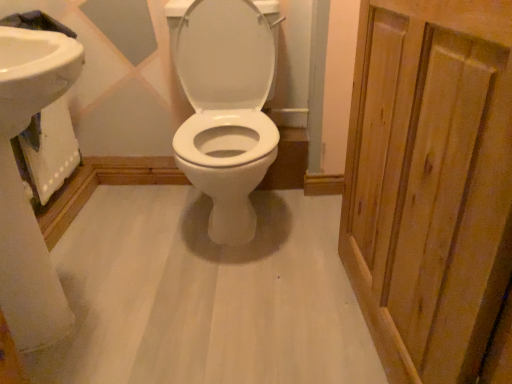
Where is `white glossy toilet at center`? Image resolution: width=512 pixels, height=384 pixels. white glossy toilet at center is located at coordinates (226, 110).

What do you see at coordinates (22, 185) in the screenshot?
I see `white glossy sink at left` at bounding box center [22, 185].

Image resolution: width=512 pixels, height=384 pixels. What do you see at coordinates (430, 182) in the screenshot?
I see `natural wood screen door at right` at bounding box center [430, 182].

What are the coordinates of `white glossy toilet at center` in the screenshot? It's located at (226, 110).

Is natural wood screen door at right facing away from white glossy toilet at center?

No, natural wood screen door at right is not facing away from white glossy toilet at center.

Who is shorter, natural wood screen door at right or white glossy toilet at center?

natural wood screen door at right is shorter.

Is point (473, 357) closer to viewer compared to point (210, 87)?

Yes, it is.

Who is bigger, natural wood screen door at right or white glossy toilet at center?

Bigger between the two is white glossy toilet at center.

Considering the points (219, 241) and (13, 102), which point is behind, point (219, 241) or point (13, 102)?

The point (219, 241) is farther.

Where is `toilet on the right of white glossy sink at left`? This screenshot has height=384, width=512. toilet on the right of white glossy sink at left is located at coordinates point(226,110).

In the image, is white glossy toilet at center positioned in front of or behind white glossy sink at left?

In the image, white glossy toilet at center appears behind white glossy sink at left.

From a real-world perspective, does white glossy toilet at center stand above white glossy sink at left?

No, from a real-world perspective, white glossy toilet at center is not above white glossy sink at left.

How many degrees apart are the facing directions of natural wood screen door at right and white glossy sink at left?

The angular difference between natural wood screen door at right and white glossy sink at left is 175 degrees.

From a real-world perspective, is natural wood screen door at right on white glossy sink at left?

Indeed, from a real-world perspective, natural wood screen door at right stands above white glossy sink at left.

Can you confirm if natural wood screen door at right is shorter than white glossy sink at left?

In fact, natural wood screen door at right may be taller than white glossy sink at left.

Where is `screen door in front of the white glossy sink at left`? The image size is (512, 384). screen door in front of the white glossy sink at left is located at coordinates (430, 182).

Which object is positioned more to the right, white glossy sink at left or white glossy toilet at center?

white glossy toilet at center is more to the right.

In terms of size, does white glossy sink at left appear bigger or smaller than white glossy toilet at center?

Clearly, white glossy sink at left is smaller in size than white glossy toilet at center.

Is point (33, 228) in front of point (245, 15)?

Yes.

Between white glossy sink at left and white glossy toilet at center, which one is positioned behind?

Positioned behind is white glossy toilet at center.

Is white glossy sink at left directly adjacent to natural wood screen door at right?

white glossy sink at left and natural wood screen door at right are clearly separated.

I want to click on screen door that appears in front of the white glossy sink at left, so click(x=430, y=182).

From a real-world perspective, which is physically above, white glossy sink at left or natural wood screen door at right?

In real-world perspective, natural wood screen door at right is above.

Considering the sizes of objects white glossy sink at left and natural wood screen door at right in the image provided, who is bigger, white glossy sink at left or natural wood screen door at right?

Bigger between the two is white glossy sink at left.

How many degrees apart are the facing directions of white glossy toilet at center and natural wood screen door at right?

84.8 degrees.

Is white glossy toilet at center facing towards natural wood screen door at right?

No.

Who is more distant, white glossy toilet at center or natural wood screen door at right?

white glossy toilet at center is further from the camera.

From the picture: Is white glossy toilet at center not within natural wood screen door at right?

white glossy toilet at center lies outside natural wood screen door at right's area.

Find the location of a particular element. The width and height of the screenshot is (512, 384). screen door that is on the right side of white glossy toilet at center is located at coordinates (430, 182).

I want to click on sink above the white glossy toilet at center (from a real-world perspective), so click(x=22, y=185).

When comparing their distances from white glossy toilet at center, does natural wood screen door at right or white glossy sink at left seem further?

Among the two, white glossy sink at left is located further to white glossy toilet at center.

Looking at the image, which one is located further to natural wood screen door at right, white glossy toilet at center or white glossy sink at left?

Among the two, white glossy sink at left is located further to natural wood screen door at right.

Based on their spatial positions, is white glossy sink at left or natural wood screen door at right further from white glossy toilet at center?

The object further to white glossy toilet at center is white glossy sink at left.

Considering their positions, is natural wood screen door at right positioned closer to white glossy sink at left than white glossy toilet at center?

white glossy toilet at center is positioned closer to the anchor white glossy sink at left.

From the image, which object appears to be nearer to white glossy sink at left, white glossy toilet at center or natural wood screen door at right?

Based on the image, white glossy toilet at center appears to be nearer to white glossy sink at left.

Considering their positions, is white glossy sink at left positioned further to natural wood screen door at right than white glossy toilet at center?

Among the two, white glossy sink at left is located further to natural wood screen door at right.

You are a GUI agent. You are given a task and a screenshot of the screen. Output one action in this format:
    pyautogui.click(x=<x>, y=<y>)
    Task: Click on the toilet between white glossy sink at left and natural wood screen door at right
    The image size is (512, 384).
    Given the screenshot: What is the action you would take?
    pyautogui.click(x=226, y=110)